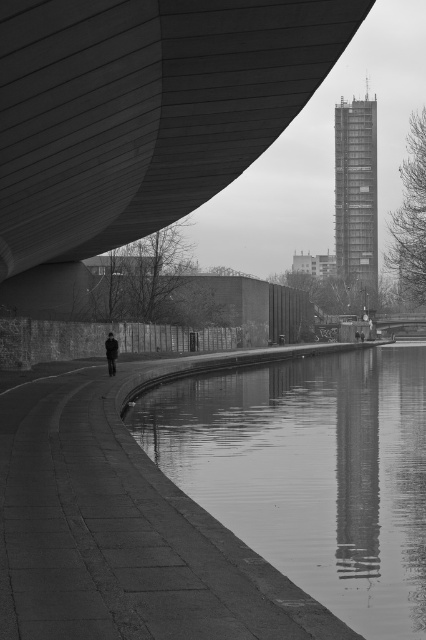
Question: Can you confirm if smooth concrete river at center is wider than dark gray fabric jacket at lower center?

Choices:
 (A) no
 (B) yes

Answer: (B)

Question: Is smooth concrete bridge at upper left bigger than smooth concrete river at center?

Choices:
 (A) yes
 (B) no

Answer: (A)

Question: Among these points, which one is nearest to the camera?

Choices:
 (A) (37, 92)
 (B) (109, 362)
 (C) (368, 432)

Answer: (A)

Question: Which of the following is the closest to the observer?

Choices:
 (A) smooth concrete bridge at upper left
 (B) dark gray fabric jacket at lower center
 (C) smooth concrete river at center

Answer: (A)

Question: Which point is farther to the camera?

Choices:
 (A) smooth concrete river at center
 (B) dark gray fabric jacket at lower center

Answer: (B)

Question: Does smooth concrete bridge at upper left have a smaller size compared to dark gray fabric jacket at lower center?

Choices:
 (A) no
 (B) yes

Answer: (A)